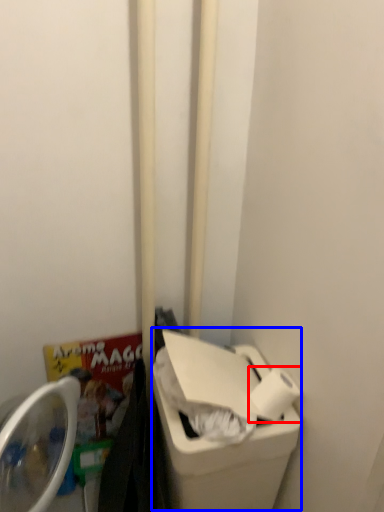
Question: Among these objects, which one is farthest to the camera, toilet paper (highlighted by a red box) or recycling bin (highlighted by a blue box)?

Choices:
 (A) toilet paper
 (B) recycling bin

Answer: (A)